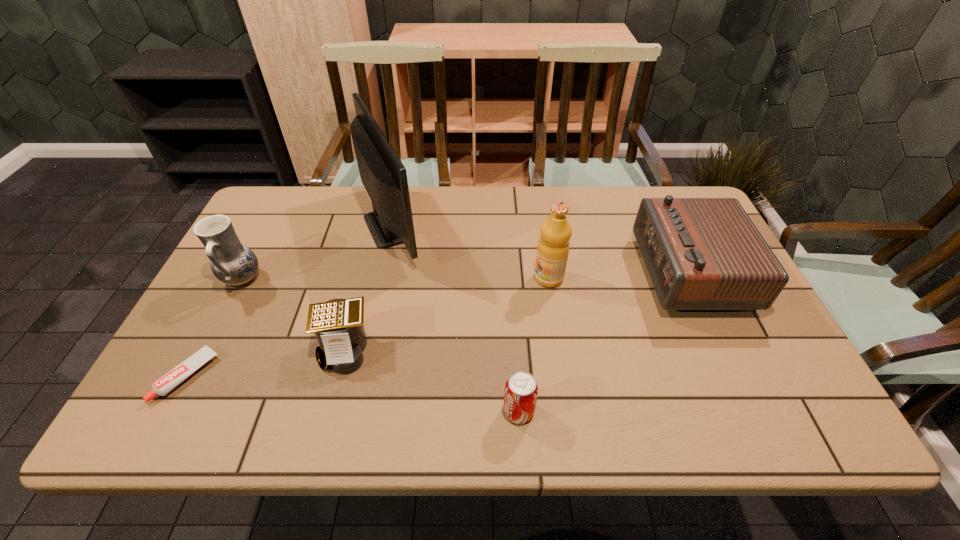
You are a GUI agent. You are given a task and a screenshot of the screen. Output one action in this format:
    pyautogui.click(x=<x>, y=<y>)
    Task: Click on the tallest object
    The height and width of the screenshot is (540, 960).
    Given the screenshot: What is the action you would take?
    382,173

Image resolution: width=960 pixels, height=540 pixels. What are the coordinates of `the second tallest object` in the screenshot? It's located at (553, 247).

Where is `fruit juice`? fruit juice is located at coordinates (553, 247).

Where is `pottery`? pottery is located at coordinates (233, 263).

Identify the location of radio receiver. The width and height of the screenshot is (960, 540). (701, 253).

The width and height of the screenshot is (960, 540). I want to click on calculator, so [x=338, y=324].

The width and height of the screenshot is (960, 540). Find the location of `the fifth object from left to right`. the fifth object from left to right is located at coordinates (521, 390).

Where is `the shortest object`? This screenshot has width=960, height=540. the shortest object is located at coordinates (173, 378).

At what (x,y) coordinates should I click in order to perform the action: click on free space located 0.190m on the front-facing side of the tallest object. Please return your answer as a coordinate pair (x, y). The image size is (960, 540). Looking at the image, I should click on (488, 226).

Where is `vacant space situated on the front label of the sixth object from left to right`? vacant space situated on the front label of the sixth object from left to right is located at coordinates (471, 278).